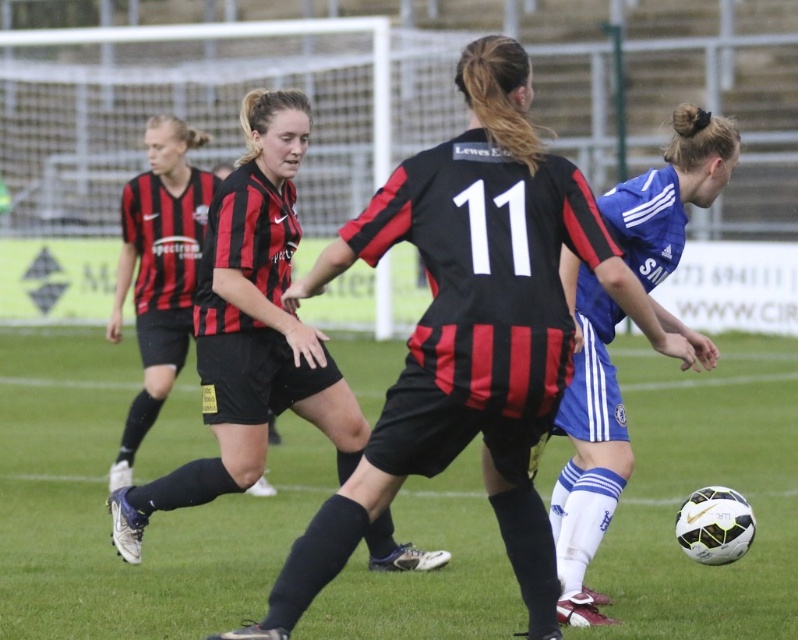
Does black matte soccer jersey at center have a smaller size compared to blue jersey at center?

No, black matte soccer jersey at center is not smaller than blue jersey at center.

Is point (247, 484) positioned behind point (556, 554)?

That is True.

Identify the location of black matte soccer jersey at center. The width and height of the screenshot is (798, 640). (251, 330).

Who is taller, green grass football field at center or black and red striped jersey at center?

black and red striped jersey at center

Who is shorter, green grass football field at center or black and red striped jersey at center?

green grass football field at center

This screenshot has height=640, width=798. Find the location of `green grass football field at center`. green grass football field at center is located at coordinates (105, 513).

Image resolution: width=798 pixels, height=640 pixels. Find the location of `green grass football field at center`. green grass football field at center is located at coordinates (105, 513).

Can you confirm if green grass football field at center is shorter than black matte soccer jersey at center?

Yes.

Based on the photo, does green grass football field at center come in front of black matte soccer jersey at center?

Yes, green grass football field at center is closer to the viewer.

This screenshot has width=798, height=640. Identify the location of green grass football field at center. tap(105, 513).

The image size is (798, 640). I want to click on green grass football field at center, so click(105, 513).